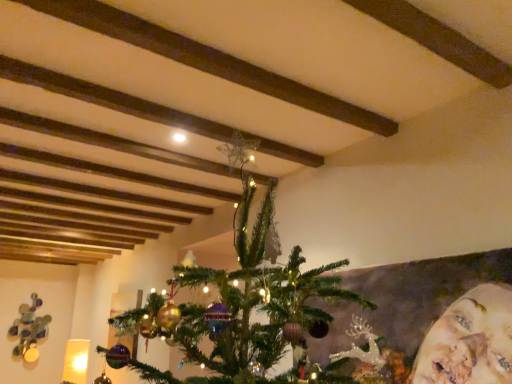
This screenshot has width=512, height=384. I want to click on metallic reflective ornaments at lower left, so click(29, 329).

This screenshot has height=384, width=512. What do you see at coordinates (29, 329) in the screenshot?
I see `metallic reflective ornaments at lower left` at bounding box center [29, 329].

Identify the location of metallic reflective ornaments at lower left. This screenshot has height=384, width=512. (29, 329).